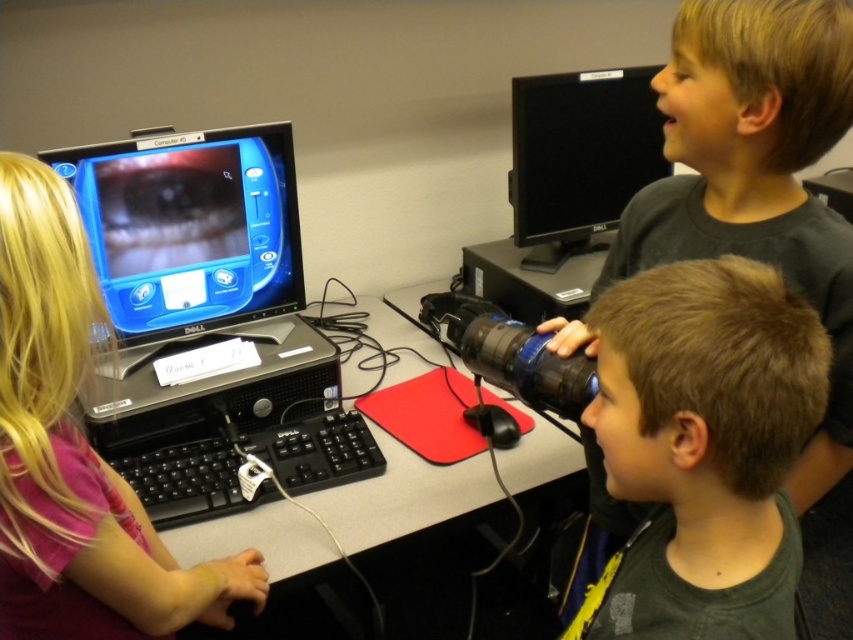
You are a photographer trying to capture a clear image of the brown matte hair at center and the matte black binoculars at center. Which object should you focus on first if you want to ensure both are in focus?

The brown matte hair at center is not as tall as the matte black binoculars at center, so you should focus on the brown matte hair at center first to ensure both are in focus.

You are setting up a new desk arrangement and need to place both the black glossy monitor at left and the smooth black desk at center. Given their sizes, which object should be placed first to ensure proper positioning?

The smooth black desk at center should be placed first because it is larger than the black glossy monitor at left, allowing for adequate space allocation.